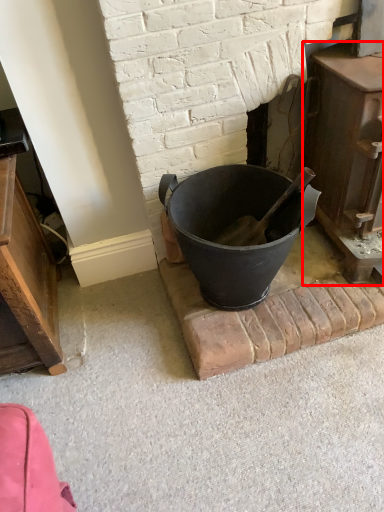
Question: From the image, what is the correct spatial relationship of fireplace (annotated by the red box) in relation to bucket?

Choices:
 (A) left
 (B) right

Answer: (B)